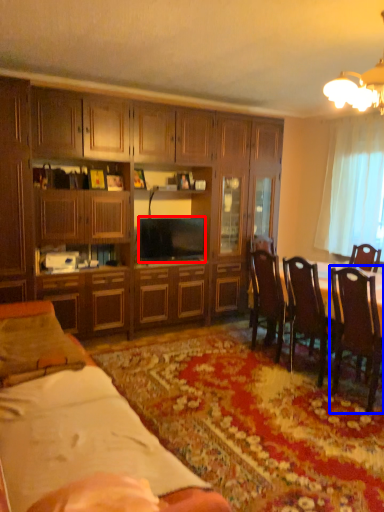
Question: Which of the following is the closest to the observer, television (highlighted by a red box) or chair (highlighted by a blue box)?

Choices:
 (A) television
 (B) chair

Answer: (B)